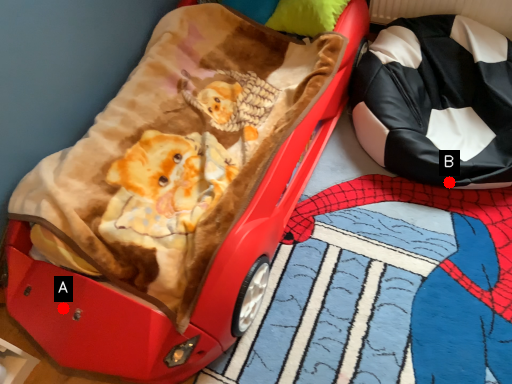
Question: Two points are circled on the image, labeled by A and B beside each circle. Which point is further to the camera?

Choices:
 (A) A is further
 (B) B is further

Answer: (B)